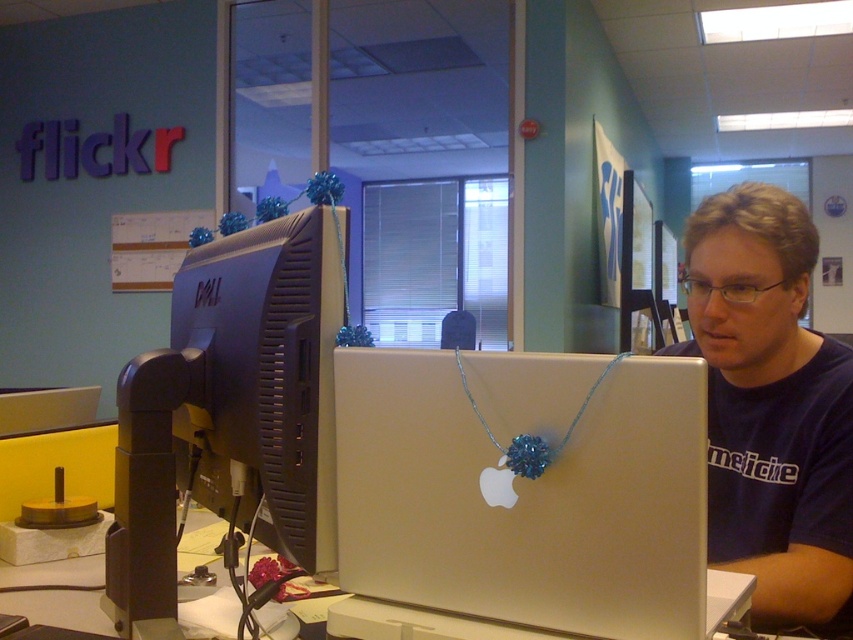
Is silver metallic laptop at center shorter than blue fabric shirt at center?

Indeed, silver metallic laptop at center has a lesser height compared to blue fabric shirt at center.

Consider the image. Can you confirm if silver metallic laptop at center is thinner than blue fabric shirt at center?

Correct, silver metallic laptop at center's width is less than blue fabric shirt at center's.

The height and width of the screenshot is (640, 853). Describe the element at coordinates (525, 490) in the screenshot. I see `silver metallic laptop at center` at that location.

Identify the location of silver metallic laptop at center. The image size is (853, 640). (525, 490).

Who is positioned more to the left, matte black monitor at left or blue fabric shirt at center?

matte black monitor at left

Does matte black monitor at left have a greater height compared to blue fabric shirt at center?

No, matte black monitor at left is not taller than blue fabric shirt at center.

Between point (248, 352) and point (741, 545), which one is positioned in front?

Point (248, 352) is in front.

This screenshot has width=853, height=640. I want to click on matte black monitor at left, so click(x=231, y=408).

Is blue fabric shirt at center in front of silver metallic computer desk at center?

That is True.

Which is above, blue fabric shirt at center or silver metallic computer desk at center?

blue fabric shirt at center is higher up.

Between point (718, 244) and point (207, 520), which one is positioned behind?

The point (207, 520) is behind.

Where is `blue fabric shirt at center`? blue fabric shirt at center is located at coordinates (770, 406).